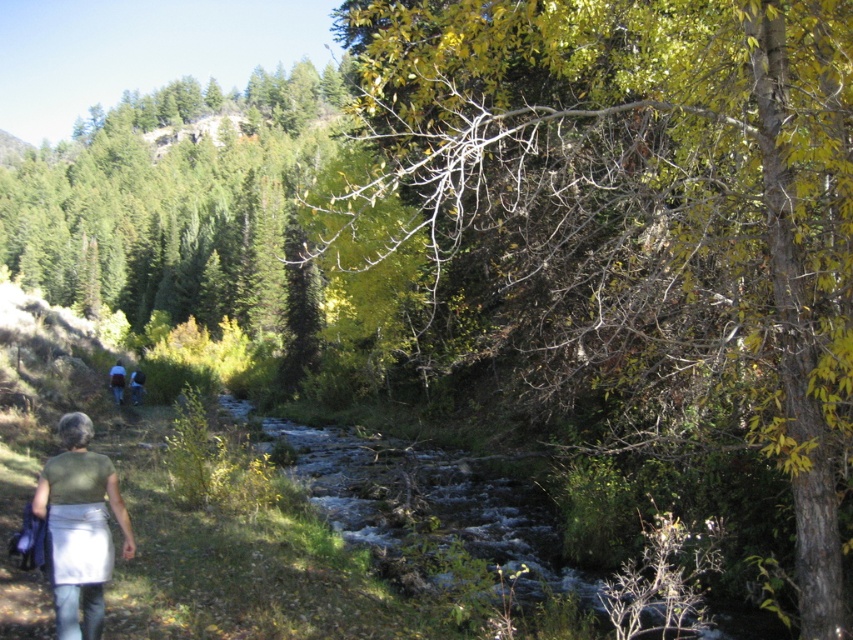
Question: Is light green fabric at lower left thinner than green fabric backpack at lower left?

Choices:
 (A) yes
 (B) no

Answer: (A)

Question: From the image, what is the correct spatial relationship of green leafy tree at upper right in relation to green fabric backpack at lower left?

Choices:
 (A) left
 (B) right

Answer: (B)

Question: Estimate the real-world distances between objects in this image. Which object is closer to the light green fabric at lower left?

Choices:
 (A) green fabric backpack at lower left
 (B) green leafy tree at upper right

Answer: (B)

Question: Which point appears closest to the camera in this image?

Choices:
 (A) (73, 516)
 (B) (764, 180)
 (C) (120, 397)

Answer: (B)

Question: Which object appears farthest from the camera in this image?

Choices:
 (A) green leafy tree at upper right
 (B) green fabric backpack at lower left

Answer: (B)

Question: Does green leafy tree at upper right appear over light green fabric at lower left?

Choices:
 (A) no
 (B) yes

Answer: (B)